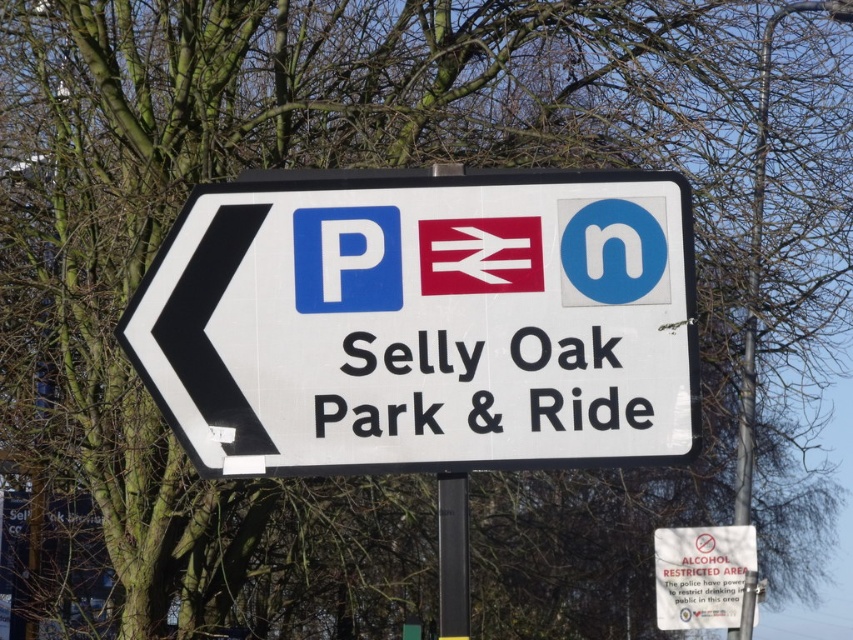
You are standing at the point marked as point (422, 321). You want to go to the white plastic sign at center. Which direction should you go?

The white plastic sign at center is located at point (422, 321), so you are already at the white plastic sign at center.

You are a delivery driver who needs to read both the white plastic sign at center and the white paper sign at center. Which one is easier to see from a distance? Please explain your reasoning based on their sizes.

The white plastic sign at center is taller than the white paper sign at center. Since it is larger in height, the white plastic sign at center would be easier to see from a distance compared to the white paper sign at center.